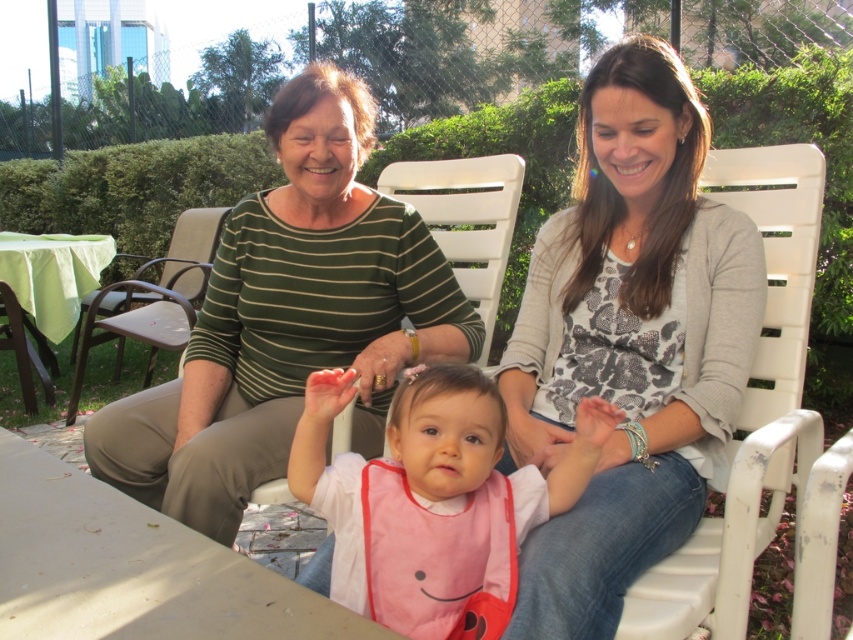
You are planning to place a small potted plant between the white plastic chair at right and the white plastic chair at center. Considering their widths, which chair has more space available on its side to accommodate the plant?

The white plastic chair at right has a greater width than the white plastic chair at center, so it likely has more space available on its side to accommodate the potted plant.

You are a photographer setting up a shoot in the garden. You need to decide whether to place a large prop next to the matte green sweater at center or the white plastic chair at right. Based on their sizes, which object would be more suitable for the prop?

The matte green sweater at center is larger in size than the white plastic chair at right, so the prop would be more appropriately placed next to the matte green sweater at center as it can better complement the prop in terms of scale.

You are standing at the point with coordinates point (161, 269) and want to walk to the point (677, 284). Which direction should you move in to reach your destination?

You should move forward because point (677, 284) is in front of point (161, 269).